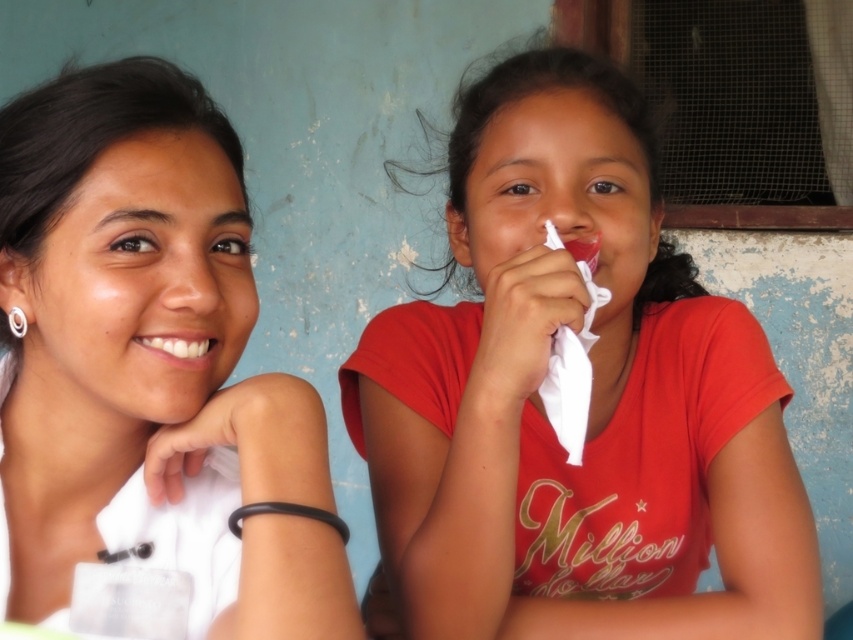
Question: Which point is farther to the camera?

Choices:
 (A) white matte shirt at upper left
 (B) white glossy teeth at center

Answer: (B)

Question: Can you confirm if white matte shirt at upper left is positioned to the right of white glossy teeth at center?

Choices:
 (A) yes
 (B) no

Answer: (B)

Question: Is red matte shirt at center bigger than white matte shirt at upper left?

Choices:
 (A) no
 (B) yes

Answer: (B)

Question: Can you confirm if white matte shirt at upper left is smaller than white glossy teeth at center?

Choices:
 (A) yes
 (B) no

Answer: (B)

Question: Which object appears farthest from the camera in this image?

Choices:
 (A) red matte shirt at center
 (B) white glossy teeth at center

Answer: (A)

Question: Among these points, which one is farthest from the camera?

Choices:
 (A) (589, 116)
 (B) (236, 472)
 (C) (148, 340)

Answer: (A)